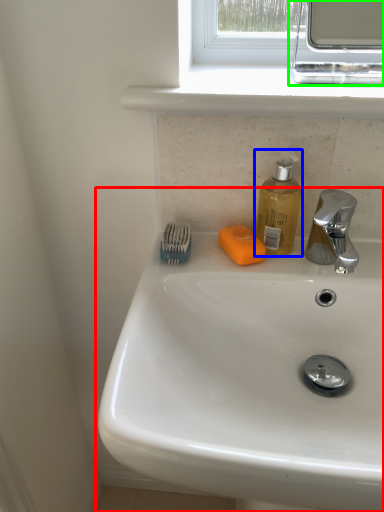
Question: Estimate the real-world distances between objects in this image. Which object is farther from sink (highlighted by a red box), soap dispenser (highlighted by a blue box) or medicine cabinet (highlighted by a green box)?

Choices:
 (A) soap dispenser
 (B) medicine cabinet

Answer: (B)